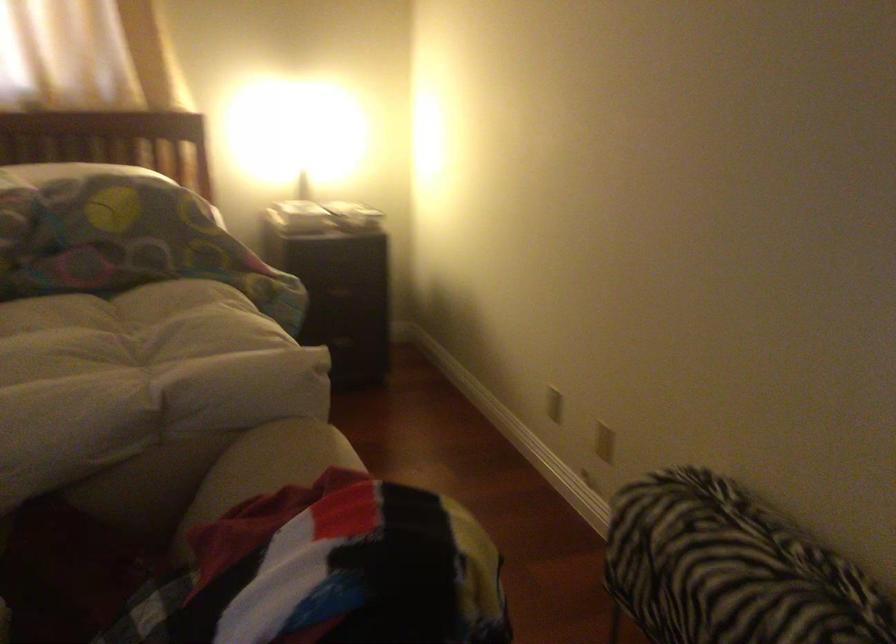
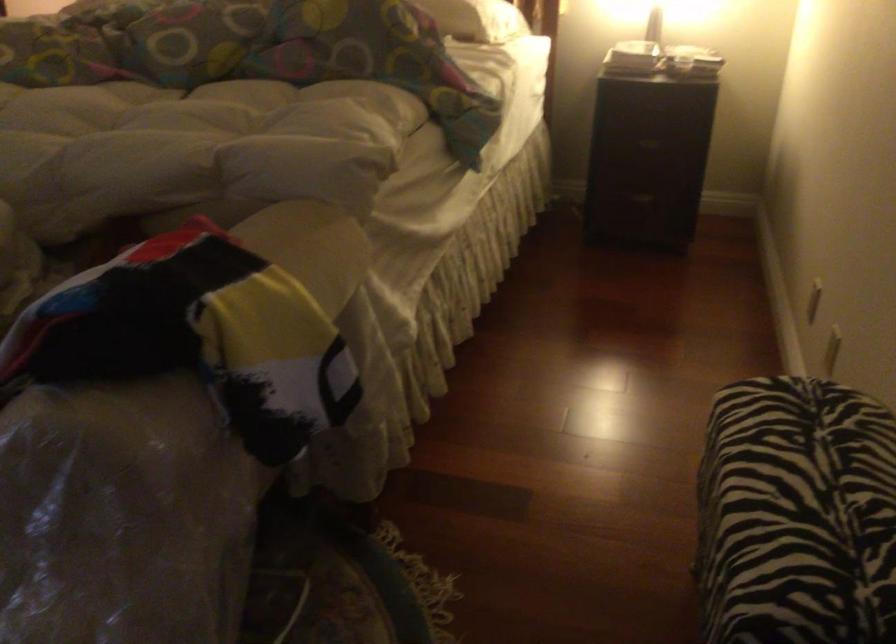
Locate, in the second image, the point that corresponds to [556,401] in the first image.

(814, 301)